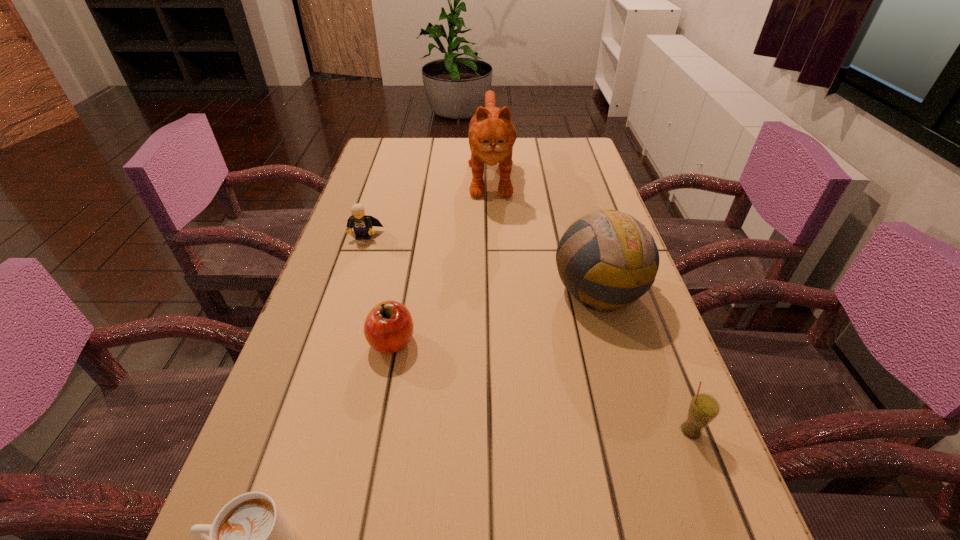
Where is `vacant position in the image that satisfies the following two spatial constraints: 1. on the front-facing side of the straw for drinking; 2. on the left side of the second farthest object`? The height and width of the screenshot is (540, 960). vacant position in the image that satisfies the following two spatial constraints: 1. on the front-facing side of the straw for drinking; 2. on the left side of the second farthest object is located at coordinates (300, 431).

Where is `free space that satisfies the following two spatial constraints: 1. on the front-facing side of the fourth object from right to left; 2. on the right side of the Lego`? The image size is (960, 540). free space that satisfies the following two spatial constraints: 1. on the front-facing side of the fourth object from right to left; 2. on the right side of the Lego is located at coordinates (329, 342).

Find the location of a particular element. The width and height of the screenshot is (960, 540). free location that satisfies the following two spatial constraints: 1. on the front-facing side of the volleyball; 2. on the left side of the Lego is located at coordinates (347, 291).

You are a GUI agent. You are given a task and a screenshot of the screen. Output one action in this format:
    pyautogui.click(x=<x>, y=<y>)
    Task: Click on the vacant space that satisfies the following two spatial constraints: 1. on the front-facing side of the fifth nearest object; 2. on the right side of the third tallest object
    This screenshot has height=540, width=960.
    Given the screenshot: What is the action you would take?
    pyautogui.click(x=300, y=431)

Locate an element on the screen. This screenshot has width=960, height=540. vacant space that satisfies the following two spatial constraints: 1. on the face of the third object from right to left; 2. on the left side of the volleyball is located at coordinates (494, 291).

This screenshot has height=540, width=960. I want to click on free spot that satisfies the following two spatial constraints: 1. on the front-facing side of the straw for drinking; 2. on the left side of the Lego, so click(x=300, y=431).

The height and width of the screenshot is (540, 960). I want to click on free space in the image that satisfies the following two spatial constraints: 1. on the face of the farthest object; 2. on the right side of the volleyball, so click(x=494, y=291).